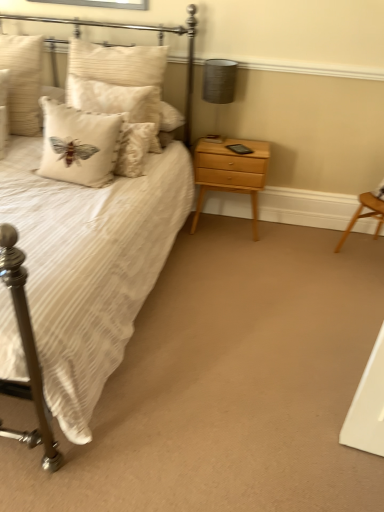
Question: Is beige textured pillow at upper left, placed as the first pillow when sorted from left to right, closer to the viewer compared to white textured pillow at upper left, which is the 3th pillow in left-to-right order?

Choices:
 (A) no
 (B) yes

Answer: (A)

Question: From a real-world perspective, is beige textured pillow at upper left, placed as the first pillow when sorted from left to right, located higher than white textured pillow at upper left, which is the 3th pillow in left-to-right order?

Choices:
 (A) no
 (B) yes

Answer: (A)

Question: Is beige textured pillow at upper left, the third pillow from the right, shorter than white textured pillow at upper left, the 1th pillow viewed from the right?

Choices:
 (A) no
 (B) yes

Answer: (B)

Question: Does beige textured pillow at upper left, the third pillow from the right, have a larger size compared to white textured pillow at upper left, which is the 3th pillow in left-to-right order?

Choices:
 (A) no
 (B) yes

Answer: (A)

Question: Considering the relative sizes of beige textured pillow at upper left, placed as the first pillow when sorted from left to right, and white textured pillow at upper left, the 1th pillow viewed from the right, in the image provided, is beige textured pillow at upper left, placed as the first pillow when sorted from left to right, taller than white textured pillow at upper left, the 1th pillow viewed from the right,?

Choices:
 (A) no
 (B) yes

Answer: (A)

Question: Is beige textured pillow at upper left, the third pillow from the right, thinner than white textured pillow at upper left, the 1th pillow viewed from the right?

Choices:
 (A) yes
 (B) no

Answer: (A)

Question: From a real-world perspective, is matte gray lampshade at upper right located beneath white striped fabric bed at left?

Choices:
 (A) no
 (B) yes

Answer: (A)

Question: Is matte gray lampshade at upper right in front of white striped fabric bed at left?

Choices:
 (A) no
 (B) yes

Answer: (A)

Question: Can you confirm if matte gray lampshade at upper right is wider than white striped fabric bed at left?

Choices:
 (A) yes
 (B) no

Answer: (B)

Question: Considering the relative sizes of matte gray lampshade at upper right and white striped fabric bed at left in the image provided, is matte gray lampshade at upper right thinner than white striped fabric bed at left?

Choices:
 (A) no
 (B) yes

Answer: (B)

Question: Does matte gray lampshade at upper right have a greater height compared to white striped fabric bed at left?

Choices:
 (A) yes
 (B) no

Answer: (B)

Question: Can you confirm if matte gray lampshade at upper right is shorter than white striped fabric bed at left?

Choices:
 (A) no
 (B) yes

Answer: (B)

Question: From the image's perspective, is beige textured pillow at upper left, placed as the first pillow when sorted from left to right, on top of white striped fabric bed at left?

Choices:
 (A) no
 (B) yes

Answer: (B)